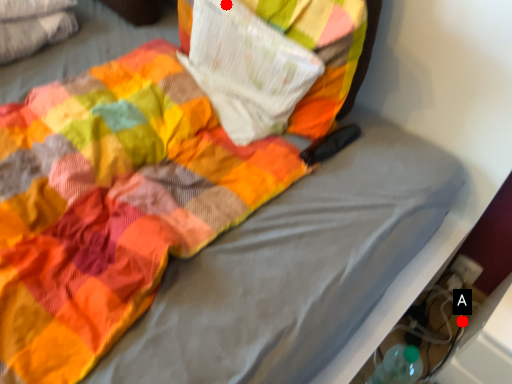
Question: Two points are circled on the image, labeled by A and B beside each circle. Which point is farther from the camera taking this photo?

Choices:
 (A) A is further
 (B) B is further

Answer: (A)